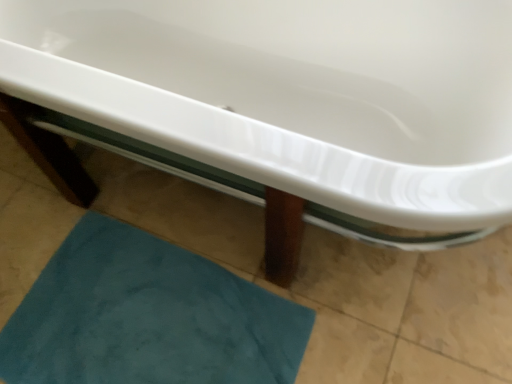
Question: In terms of height, does teal plush bath mat at lower left look taller or shorter compared to white glossy bathtub at center?

Choices:
 (A) short
 (B) tall

Answer: (A)

Question: From a real-world perspective, relative to white glossy bathtub at center, is teal plush bath mat at lower left vertically above or below?

Choices:
 (A) above
 (B) below

Answer: (B)

Question: From the image's perspective, relative to white glossy bathtub at center, is teal plush bath mat at lower left above or below?

Choices:
 (A) below
 (B) above

Answer: (A)

Question: From their relative heights in the image, would you say white glossy bathtub at center is taller or shorter than teal plush bath mat at lower left?

Choices:
 (A) short
 (B) tall

Answer: (B)

Question: Considering their positions, is white glossy bathtub at center located in front of or behind teal plush bath mat at lower left?

Choices:
 (A) behind
 (B) front

Answer: (B)

Question: Is white glossy bathtub at center inside the boundaries of teal plush bath mat at lower left, or outside?

Choices:
 (A) outside
 (B) inside

Answer: (A)

Question: Is point (183, 44) positioned closer to the camera than point (94, 380)?

Choices:
 (A) closer
 (B) farther

Answer: (B)